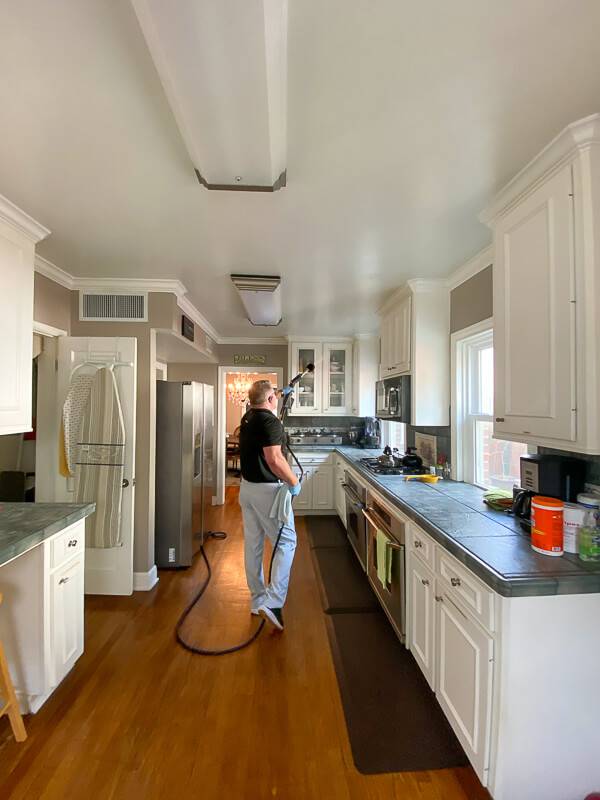
Locate an element on the screen. microwave door handle is located at coordinates (390, 401).